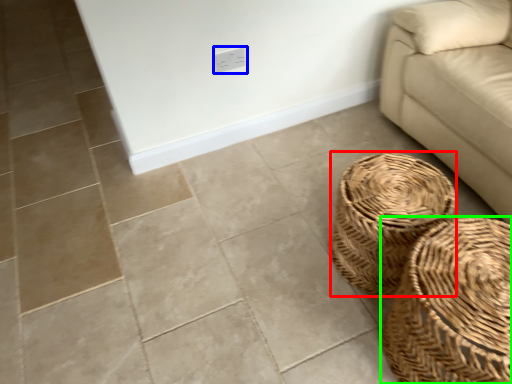
Question: Estimate the real-world distances between objects in this image. Which object is farther from basket (highlighted by a red box), electric outlet (highlighted by a blue box) or basket (highlighted by a green box)?

Choices:
 (A) electric outlet
 (B) basket

Answer: (A)